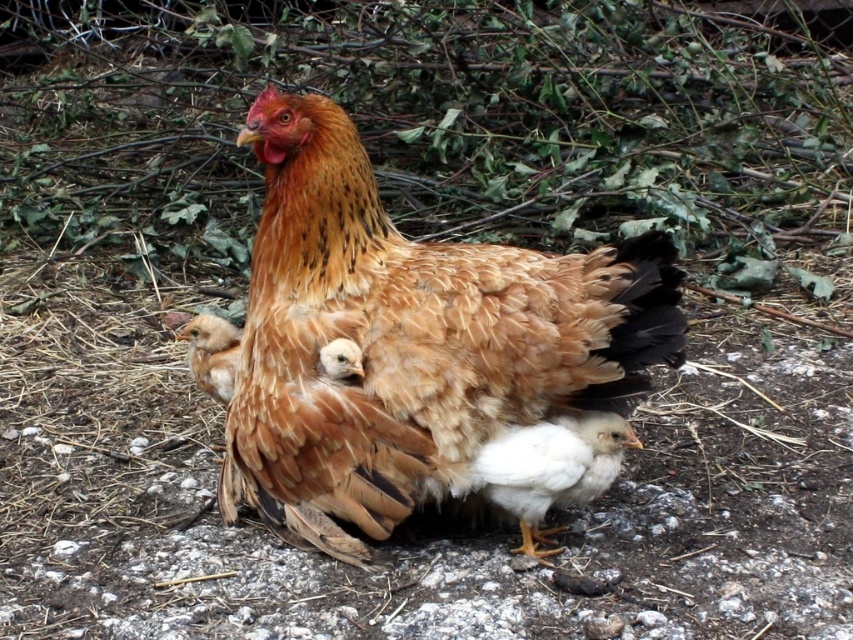
Question: Is white fluffy chick at center behind brown fluffy chick at center?

Choices:
 (A) no
 (B) yes

Answer: (A)

Question: Can you confirm if brown feathered hen at center is positioned above brown fluffy chick at center?

Choices:
 (A) yes
 (B) no

Answer: (A)

Question: Does brown feathered hen at center have a smaller size compared to white fluffy chick at center?

Choices:
 (A) yes
 (B) no

Answer: (B)

Question: Which is nearer to the white fluffy chick at center?

Choices:
 (A) brown feathered hen at center
 (B) brown fluffy chick at center

Answer: (A)

Question: Which of the following is the closest to the observer?

Choices:
 (A) white fluffy chick at center
 (B) brown fluffy chick at center

Answer: (A)

Question: Based on their relative distances, which object is farther from the brown fluffy chick at center?

Choices:
 (A) white fluffy chick at center
 (B) brown feathered hen at center

Answer: (A)